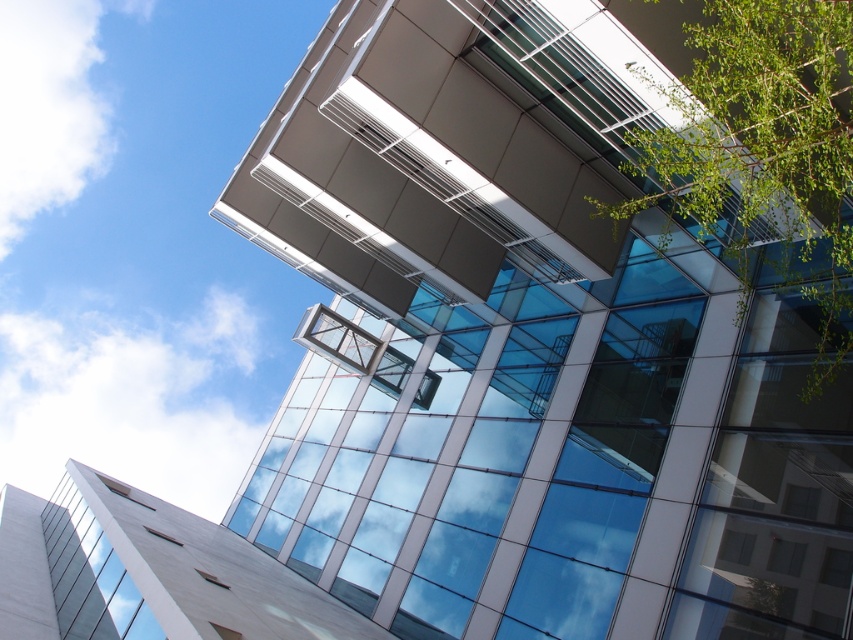
Can you confirm if green leafy tree at upper right is positioned to the left of transparent glass window at lower left?

No, green leafy tree at upper right is not to the left of transparent glass window at lower left.

Who is more distant from viewer, (793, 77) or (88, 524)?

Positioned behind is point (88, 524).

In order to click on green leafy tree at upper right in this screenshot , I will do [762, 154].